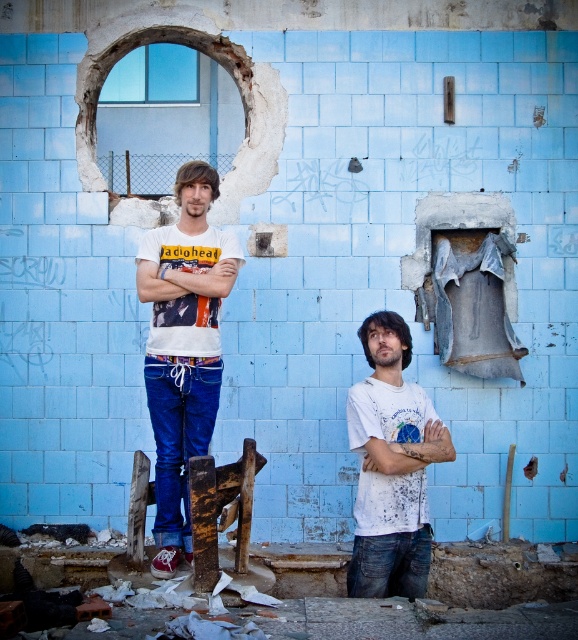
Between white cotton t-shirt at center and white matte t-shirt at center, which one appears on the left side from the viewer's perspective?

Positioned to the left is white cotton t-shirt at center.

Does white cotton t-shirt at center have a larger size compared to white matte t-shirt at center?

Yes.

Which is in front, point (165, 497) or point (423, 483)?

Point (165, 497) is in front.

Find the location of a particular element. white cotton t-shirt at center is located at coordinates (183, 346).